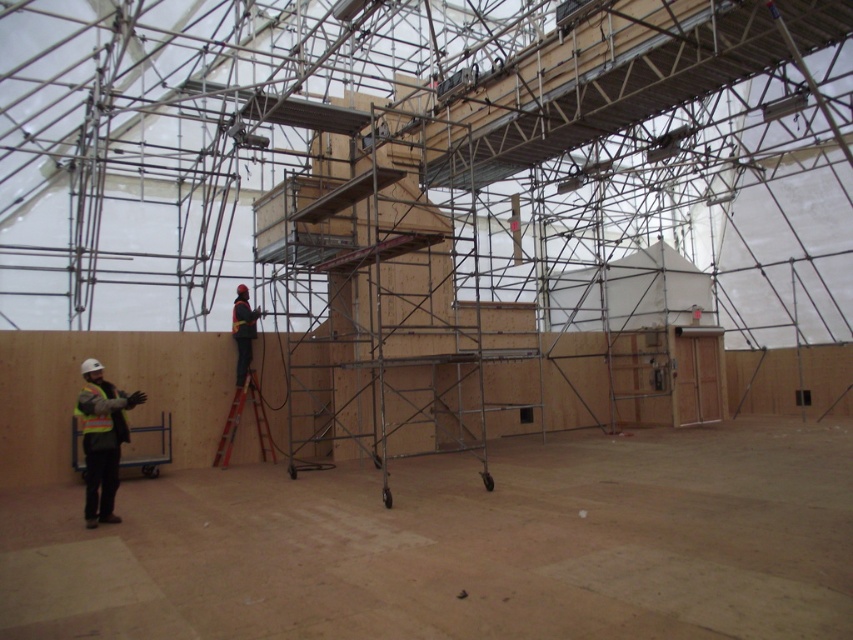
Does red wooden ladder at center lie behind reflective yellow-green safety vest at lower left?

That is True.

Does point (230, 420) lie behind point (91, 385)?

Yes, it is behind point (91, 385).

Is point (260, 394) farther from camera compared to point (100, 432)?

Yes, it is.

Where is `red wooden ladder at center`? The width and height of the screenshot is (853, 640). red wooden ladder at center is located at coordinates (238, 422).

Does point (99, 371) lie behind point (94, 420)?

Yes, point (99, 371) is farther from viewer.

Between point (80, 406) and point (100, 424), which one is positioned behind?

The point (100, 424) is more distant.

Measure the distance between reflective yellow safety vest at lower left and camera.

reflective yellow safety vest at lower left is 8.47 meters from camera.

This screenshot has height=640, width=853. In order to click on reflective yellow safety vest at lower left in this screenshot , I will do `click(102, 440)`.

Can you confirm if reflective yellow safety vest at lower left is positioned to the left of dark blue fabric construction worker at center?

Indeed, reflective yellow safety vest at lower left is positioned on the left side of dark blue fabric construction worker at center.

I want to click on reflective yellow safety vest at lower left, so click(102, 440).

Is point (91, 492) positioned before point (245, 348)?

That is True.

The height and width of the screenshot is (640, 853). I want to click on reflective yellow safety vest at lower left, so click(x=102, y=440).